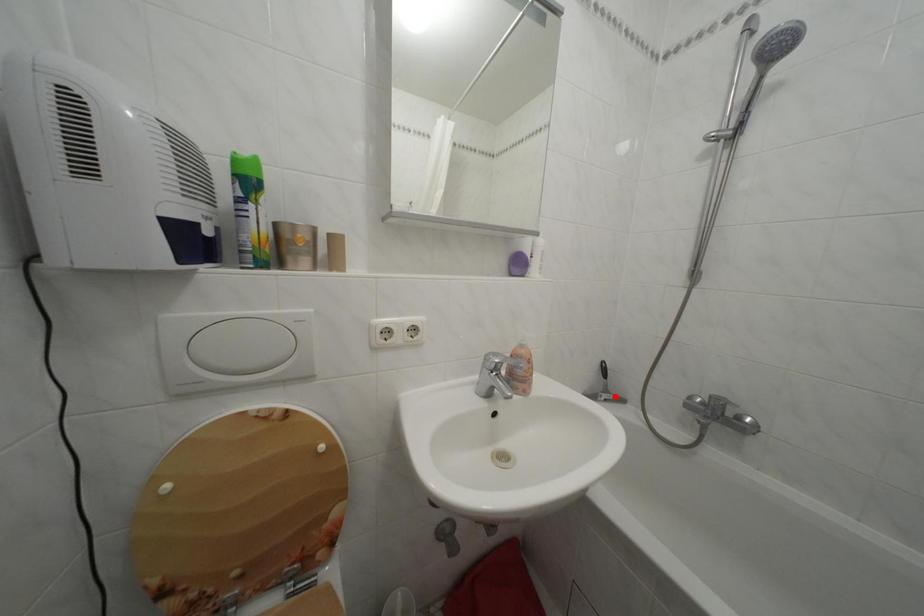
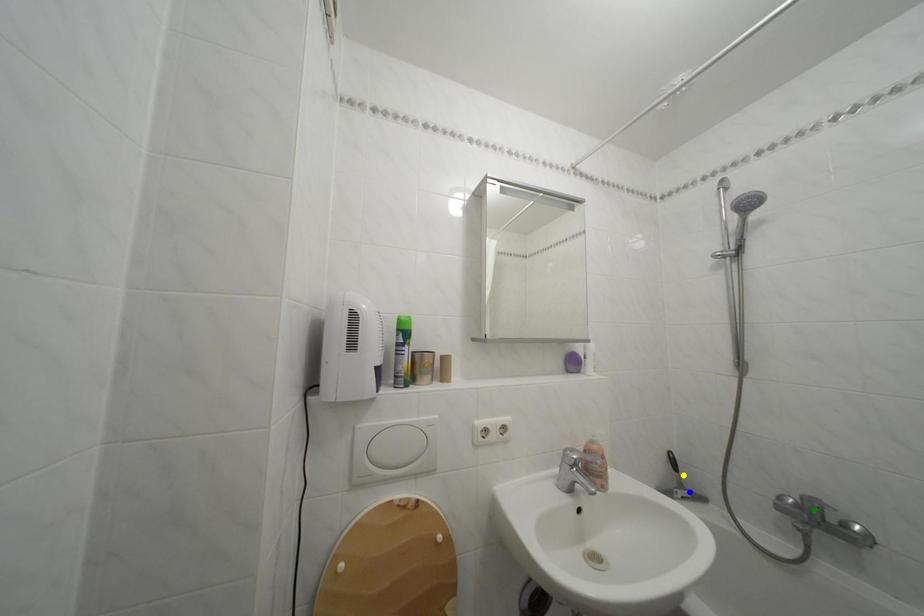
Question: I am providing you with two images of the same scene from different viewpoints. A red point is marked on the first image. You are given multiple points on the second image. Which point in image 2 is actually the same real-world point as the red point in image 1?

Choices:
 (A) green point
 (B) blue point
 (C) yellow point

Answer: (B)